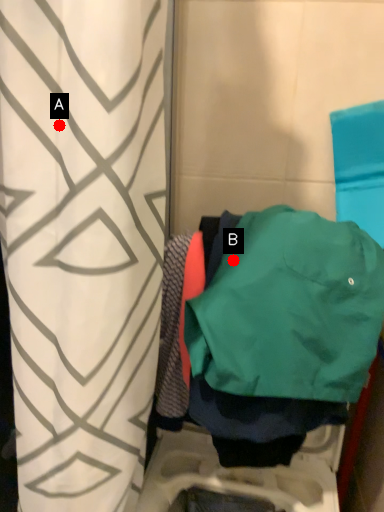
Question: Two points are circled on the image, labeled by A and B beside each circle. Which point appears closest to the camera in this image?

Choices:
 (A) A is closer
 (B) B is closer

Answer: (A)